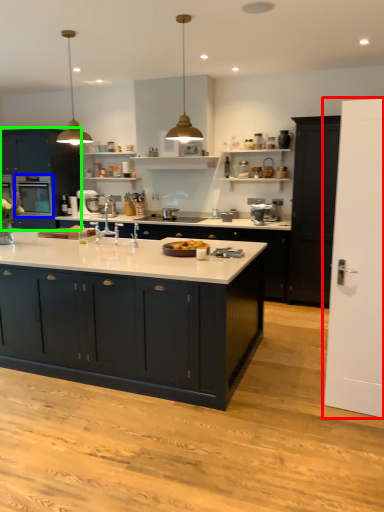
Question: Considering the real-world distances, which object is farthest from door (highlighted by a red box)? home appliance (highlighted by a blue box) or cabinetry (highlighted by a green box)?

Choices:
 (A) home appliance
 (B) cabinetry

Answer: (B)